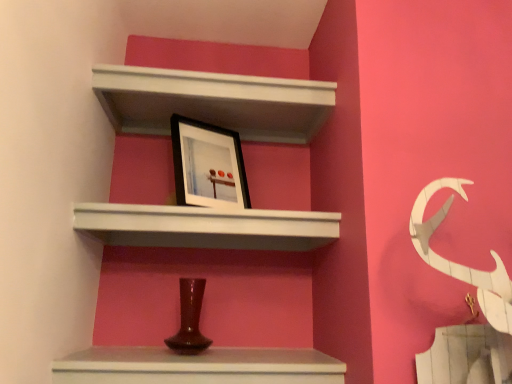
Question: Can you confirm if black matte picture frame at upper center is smaller than white matte shelf at upper center, which appears as the 1th shelf when viewed from the top?

Choices:
 (A) no
 (B) yes

Answer: (B)

Question: Is black matte picture frame at upper center facing towards white matte shelf at upper center, which appears as the 1th shelf when viewed from the top?

Choices:
 (A) yes
 (B) no

Answer: (B)

Question: From a real-world perspective, is black matte picture frame at upper center below white matte shelf at upper center, the second shelf from the bottom?

Choices:
 (A) yes
 (B) no

Answer: (A)

Question: From the image's perspective, is black matte picture frame at upper center beneath white matte shelf at upper center, which appears as the 1th shelf when viewed from the top?

Choices:
 (A) yes
 (B) no

Answer: (A)

Question: From a real-world perspective, is black matte picture frame at upper center physically above white matte shelf at upper center, which appears as the 1th shelf when viewed from the top?

Choices:
 (A) yes
 (B) no

Answer: (B)

Question: Considering the relative sizes of black matte picture frame at upper center and white matte shelf at upper center, which appears as the 1th shelf when viewed from the top, in the image provided, is black matte picture frame at upper center bigger than white matte shelf at upper center, which appears as the 1th shelf when viewed from the top,?

Choices:
 (A) yes
 (B) no

Answer: (B)

Question: Can black matte picture frame at upper center be found inside matte brown vase at lower center?

Choices:
 (A) yes
 (B) no

Answer: (B)

Question: Is matte brown vase at lower center next to black matte picture frame at upper center and touching it?

Choices:
 (A) no
 (B) yes

Answer: (A)

Question: Does matte brown vase at lower center appear on the left side of black matte picture frame at upper center?

Choices:
 (A) no
 (B) yes

Answer: (A)

Question: Considering the relative sizes of matte brown vase at lower center and black matte picture frame at upper center in the image provided, is matte brown vase at lower center bigger than black matte picture frame at upper center?

Choices:
 (A) yes
 (B) no

Answer: (A)

Question: Is matte brown vase at lower center oriented away from black matte picture frame at upper center?

Choices:
 (A) no
 (B) yes

Answer: (A)

Question: Considering the relative positions of matte brown vase at lower center and black matte picture frame at upper center in the image provided, is matte brown vase at lower center behind black matte picture frame at upper center?

Choices:
 (A) yes
 (B) no

Answer: (B)

Question: Can you confirm if white matte shelf at upper center, which is the 1th shelf from bottom to top, is wider than white matte shelf at upper center, which appears as the 1th shelf when viewed from the top?

Choices:
 (A) no
 (B) yes

Answer: (B)